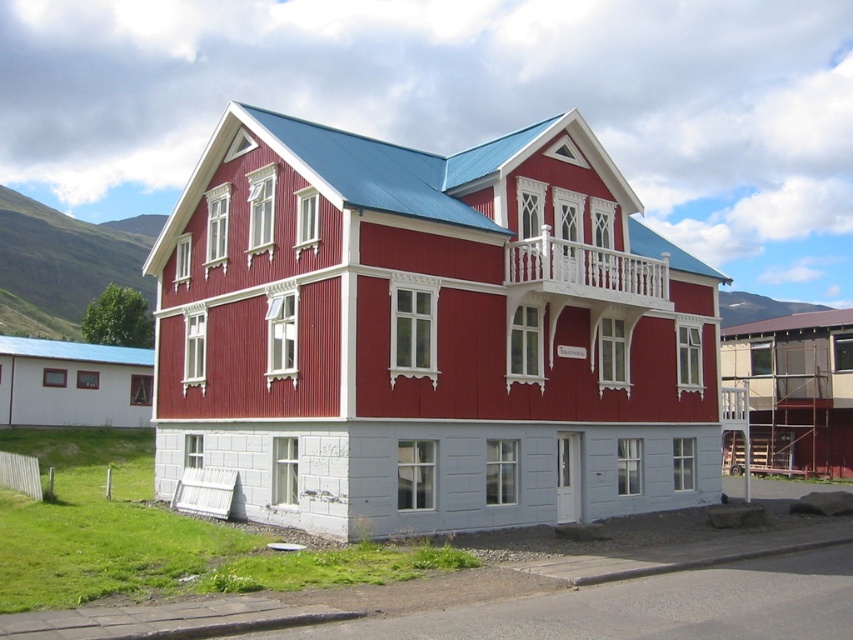
Question: Which point appears closest to the camera in this image?

Choices:
 (A) (480, 170)
 (B) (566, 260)

Answer: (B)

Question: Which of the following is the closest to the observer?

Choices:
 (A) (672, 342)
 (B) (598, 273)

Answer: (B)

Question: Where is white wooden balcony at center located in relation to white wooden balcony at upper center in the image?

Choices:
 (A) below
 (B) above

Answer: (A)

Question: Can you confirm if white wooden balcony at center is positioned to the right of white wooden balcony at upper center?

Choices:
 (A) no
 (B) yes

Answer: (A)

Question: Can you confirm if white wooden balcony at center is positioned above white wooden balcony at upper center?

Choices:
 (A) no
 (B) yes

Answer: (A)